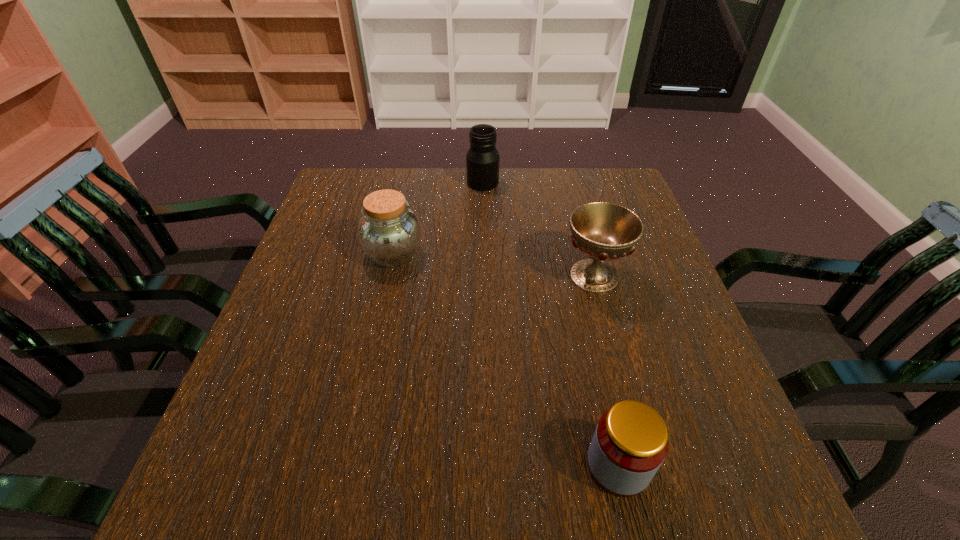
Image resolution: width=960 pixels, height=540 pixels. Find the location of `empty space that is in between the chalice and the rightmost jar`. empty space that is in between the chalice and the rightmost jar is located at coordinates (606, 370).

Image resolution: width=960 pixels, height=540 pixels. In order to click on vacant area that lies between the chalice and the farthest object in this screenshot , I will do `click(539, 229)`.

The height and width of the screenshot is (540, 960). Find the location of `unoccupied position between the second jar from right to left and the leftmost object`. unoccupied position between the second jar from right to left and the leftmost object is located at coordinates (438, 219).

Find the location of a particular element. unoccupied area between the nearest object and the farthest jar is located at coordinates (550, 324).

Locate an element on the screen. free area in between the rightmost jar and the leftmost object is located at coordinates (506, 360).

Locate an element on the screen. The width and height of the screenshot is (960, 540). vacant area between the farthest jar and the nearest jar is located at coordinates (550, 324).

Locate an element on the screen. This screenshot has width=960, height=540. free spot between the farthest object and the rightmost jar is located at coordinates (550, 324).

The width and height of the screenshot is (960, 540). Find the location of `vacant point located between the shortest jar and the farthest jar`. vacant point located between the shortest jar and the farthest jar is located at coordinates (550, 324).

Identify the location of free space between the leftmost object and the shortest object. (506, 360).

At what (x,y) coordinates should I click in order to perform the action: click on unoccupied area between the chalice and the leftmost object. Please return your answer as a coordinate pair (x, y). This screenshot has height=540, width=960. Looking at the image, I should click on (493, 265).